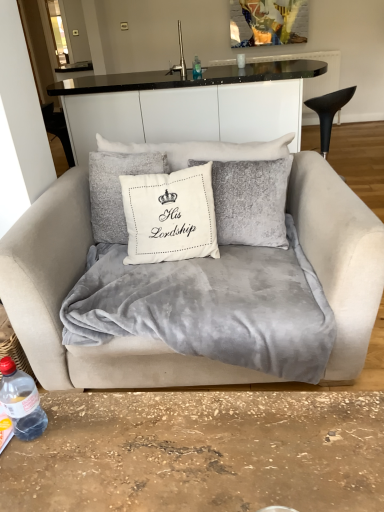
Question: Can you confirm if transparent plastic bottle at center, positioned as the 1th bottle in right-to-left order, is taller than white ceramic cup at upper center?

Choices:
 (A) no
 (B) yes

Answer: (B)

Question: Is transparent plastic bottle at center, marked as the second bottle in a left-to-right arrangement, smaller than white ceramic cup at upper center?

Choices:
 (A) yes
 (B) no

Answer: (B)

Question: Could you tell me if transparent plastic bottle at center, marked as the second bottle in a left-to-right arrangement, is facing white ceramic cup at upper center?

Choices:
 (A) yes
 (B) no

Answer: (B)

Question: Is transparent plastic bottle at center, positioned as the 1th bottle in right-to-left order, placed right next to white ceramic cup at upper center?

Choices:
 (A) no
 (B) yes

Answer: (A)

Question: From the image's perspective, is transparent plastic bottle at center, which ranks as the second bottle in front-to-back order, below white ceramic cup at upper center?

Choices:
 (A) yes
 (B) no

Answer: (A)

Question: Considering the relative positions of velvet beige couch at center and velvet gray blanket at center in the image provided, is velvet beige couch at center to the left or to the right of velvet gray blanket at center?

Choices:
 (A) left
 (B) right

Answer: (A)

Question: Is velvet beige couch at center taller or shorter than velvet gray blanket at center?

Choices:
 (A) tall
 (B) short

Answer: (A)

Question: From the image's perspective, relative to velvet gray blanket at center, is velvet beige couch at center above or below?

Choices:
 (A) below
 (B) above

Answer: (B)

Question: Considering the positions of point (54, 229) and point (319, 374), is point (54, 229) closer or farther from the camera than point (319, 374)?

Choices:
 (A) farther
 (B) closer

Answer: (A)

Question: Relative to velvet beige couch at center, is transparent plastic bottle at lower left, which is the 2th bottle from top to bottom, in front or behind?

Choices:
 (A) front
 (B) behind

Answer: (A)

Question: Considering the positions of point (23, 392) and point (369, 216), is point (23, 392) closer or farther from the camera than point (369, 216)?

Choices:
 (A) farther
 (B) closer

Answer: (B)

Question: From a real-world perspective, is transparent plastic bottle at lower left, which is the 2th bottle from top to bottom, physically located above or below velvet beige couch at center?

Choices:
 (A) above
 (B) below

Answer: (A)

Question: Considering the relative positions of transparent plastic bottle at lower left, which appears as the first bottle when viewed from the front, and velvet beige couch at center in the image provided, is transparent plastic bottle at lower left, which appears as the first bottle when viewed from the front, to the left or to the right of velvet beige couch at center?

Choices:
 (A) left
 (B) right

Answer: (A)

Question: Is point (223, 278) positioned closer to the camera than point (51, 305)?

Choices:
 (A) farther
 (B) closer

Answer: (A)

Question: Is velvet gray blanket at center bigger or smaller than velvet beige couch at center?

Choices:
 (A) small
 (B) big

Answer: (A)